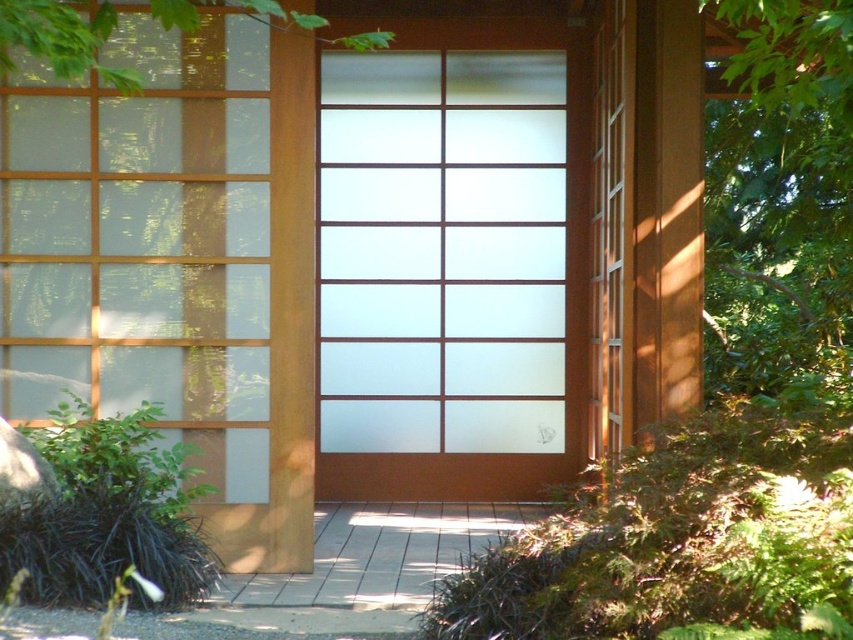
From the picture: Does frosted glass window at left have a larger size compared to green leafy tree at upper left?

Correct, frosted glass window at left is larger in size than green leafy tree at upper left.

From the picture: Is frosted glass window at left further to the viewer compared to green leafy tree at upper left?

Yes.

Identify the location of frosted glass window at left. The width and height of the screenshot is (853, 640). (144, 241).